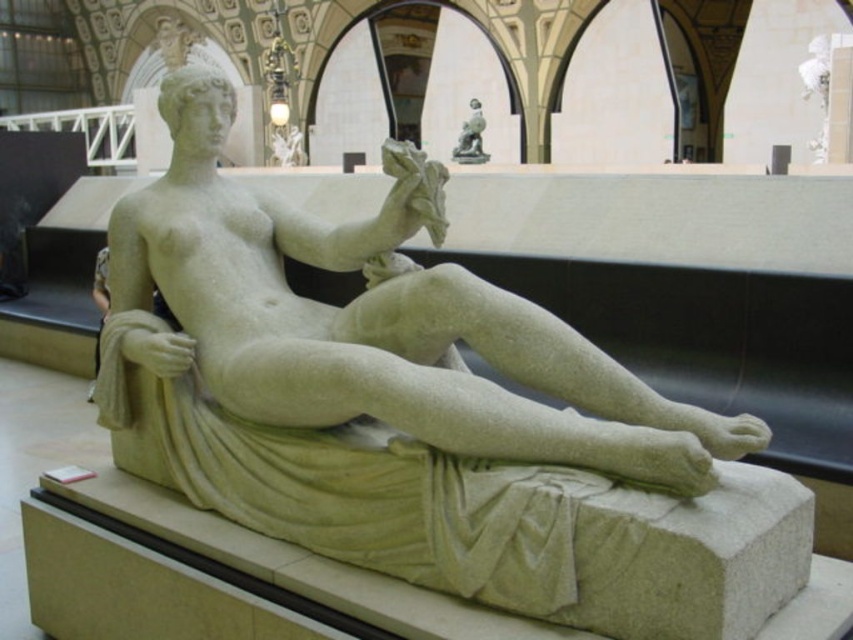
Is point (585, 365) positioned before point (468, 147)?

Yes, it is.

Identify the location of smooth stone statue at center. (376, 321).